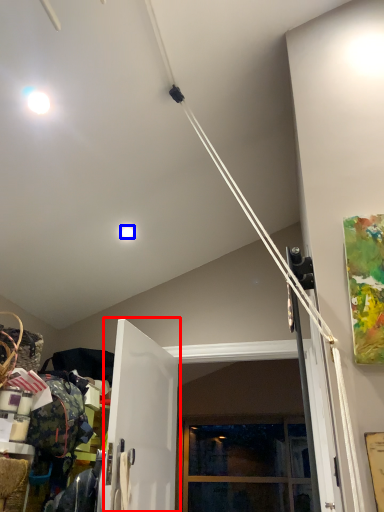
Question: Which point is further to the camera, door (highlighted by a red box) or droplight (highlighted by a blue box)?

Choices:
 (A) door
 (B) droplight

Answer: (B)